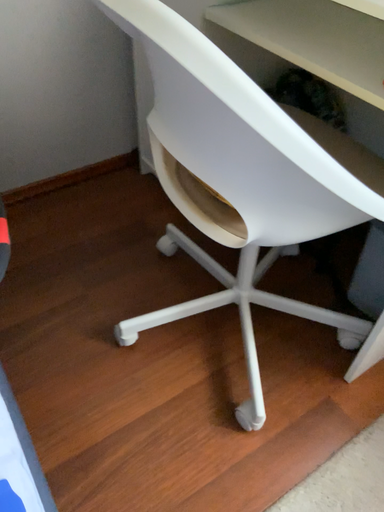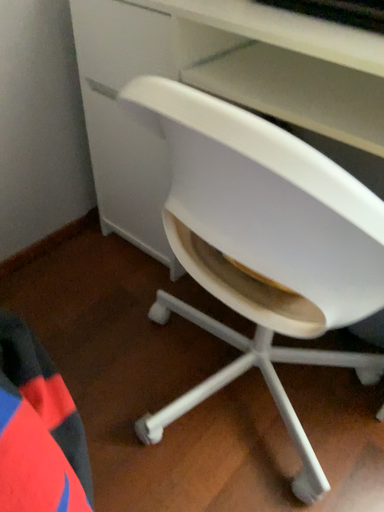
Question: How did the camera likely rotate when shooting the video?

Choices:
 (A) rotated left
 (B) rotated right

Answer: (B)